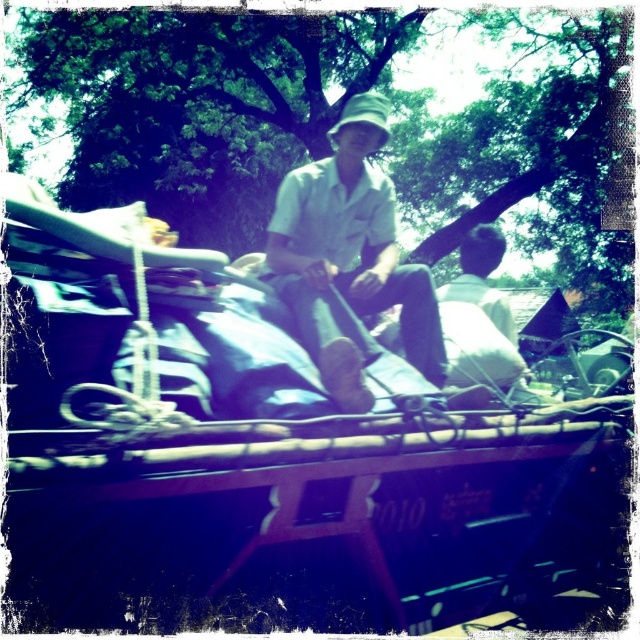
Question: Which point is closer to the camera taking this photo?

Choices:
 (A) (419, 280)
 (B) (237, 328)

Answer: (B)

Question: Among these points, which one is nearest to the camera?

Choices:
 (A) (400, 556)
 (B) (344, 198)

Answer: (A)

Question: Is wooden boat at center positioned before white matte shirt at center?

Choices:
 (A) no
 (B) yes

Answer: (B)

Question: Is wooden boat at center closer to the viewer compared to white matte shirt at center?

Choices:
 (A) no
 (B) yes

Answer: (B)

Question: Observing the image, what is the correct spatial positioning of wooden boat at center in reference to white matte shirt at center?

Choices:
 (A) left
 (B) right

Answer: (B)